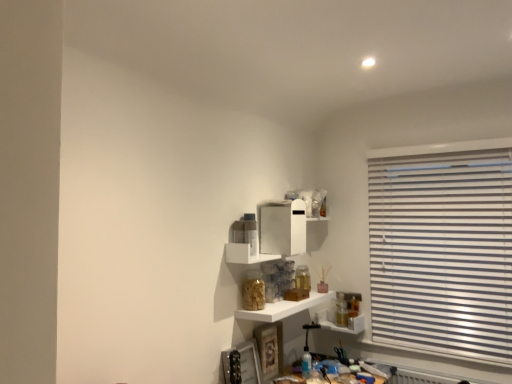
Question: Considering their positions, is white glossy shelf at center, the 2th shelf when ordered from bottom to top, located in front of or behind white glossy shelf at center, which ranks as the third shelf in bottom-to-top order?

Choices:
 (A) front
 (B) behind

Answer: (B)

Question: Based on their positions, is white glossy shelf at center, which is the second shelf from top to bottom, located to the left or right of white glossy shelf at center, which ranks as the third shelf in bottom-to-top order?

Choices:
 (A) left
 (B) right

Answer: (B)

Question: Estimate the real-world distances between objects in this image. Which object is closer to the white glossy shelf at center, which ranks as the third shelf in bottom-to-top order?

Choices:
 (A) translucent glass jar at lower right, which appears as the first shelf when ordered from the bottom
 (B) white glossy shelf at center, the 2th shelf when ordered from bottom to top

Answer: (B)

Question: Which object is the closest to the translucent glass jar at lower right, which is the 3th shelf in top-to-bottom order?

Choices:
 (A) white glossy shelf at center, which ranks as the third shelf in bottom-to-top order
 (B) white glossy shelf at center, the 2th shelf when ordered from bottom to top

Answer: (B)